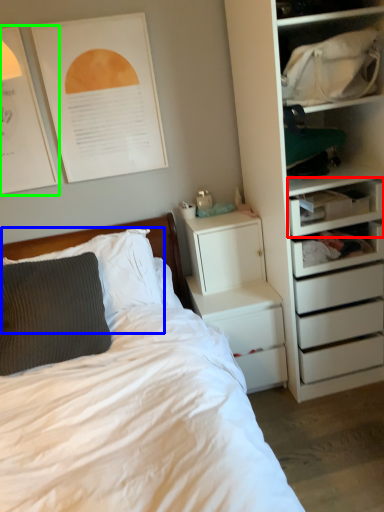
Question: Considering the real-world distances, which object is closest to shelf (highlighted by a red box)? pillow (highlighted by a blue box) or poster page (highlighted by a green box).

Choices:
 (A) pillow
 (B) poster page

Answer: (A)